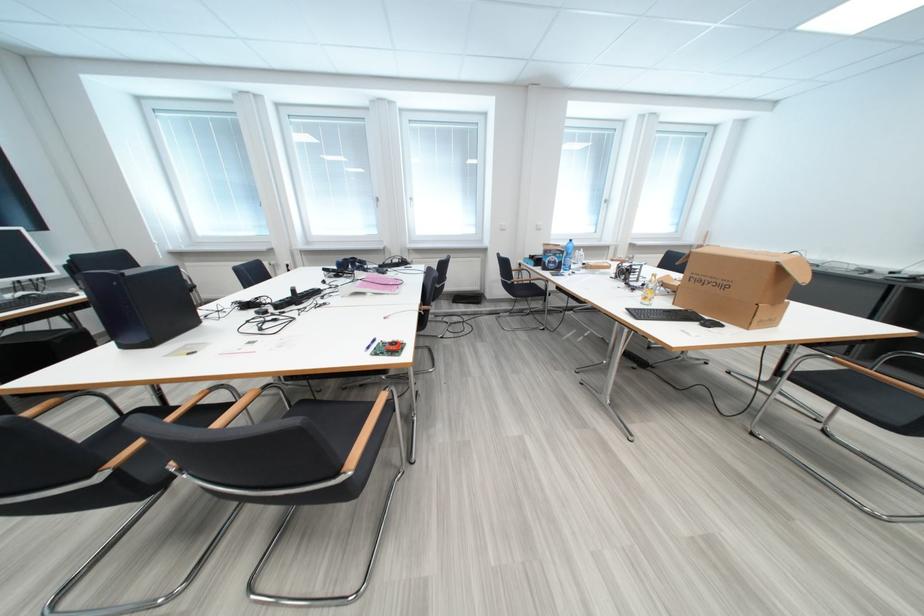
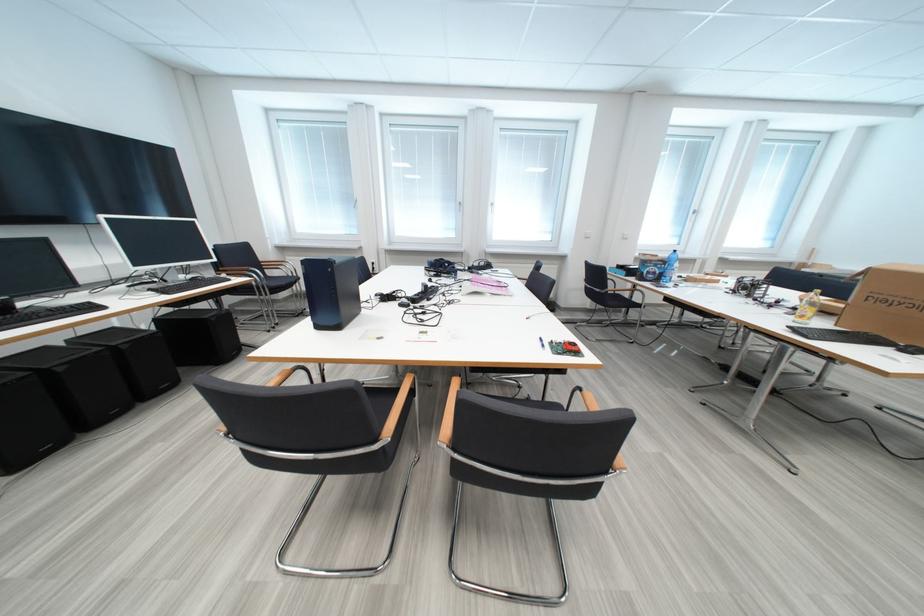
In the second image, find the point that corresponds to point (268, 315) in the first image.

(411, 307)